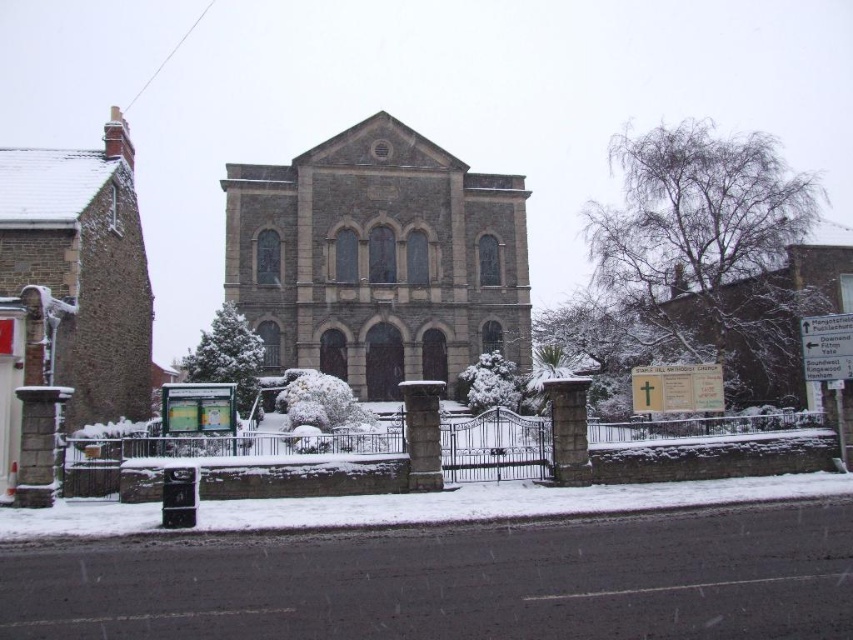
You are standing in front of the stone building and want to take a photo that includes both the point at coordinates point (376, 396) and point (10, 224). Which point should you focus on first to ensure both are in sharp focus?

You should focus on point (10, 224) first because it is closer to the camera than point (376, 396). This ensures that the depth of field will cover both points effectively.

You are standing at the center of the image. Which direction should you walk to reach the brown stone church at left?

You should walk to the left to reach the brown stone church at left since it is located at point (73,284), which is to the left of the center point.